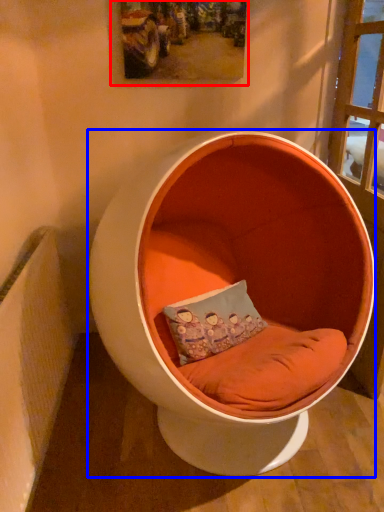
Question: Among these objects, which one is farthest to the camera, picture frame (highlighted by a red box) or furniture (highlighted by a blue box)?

Choices:
 (A) picture frame
 (B) furniture

Answer: (A)